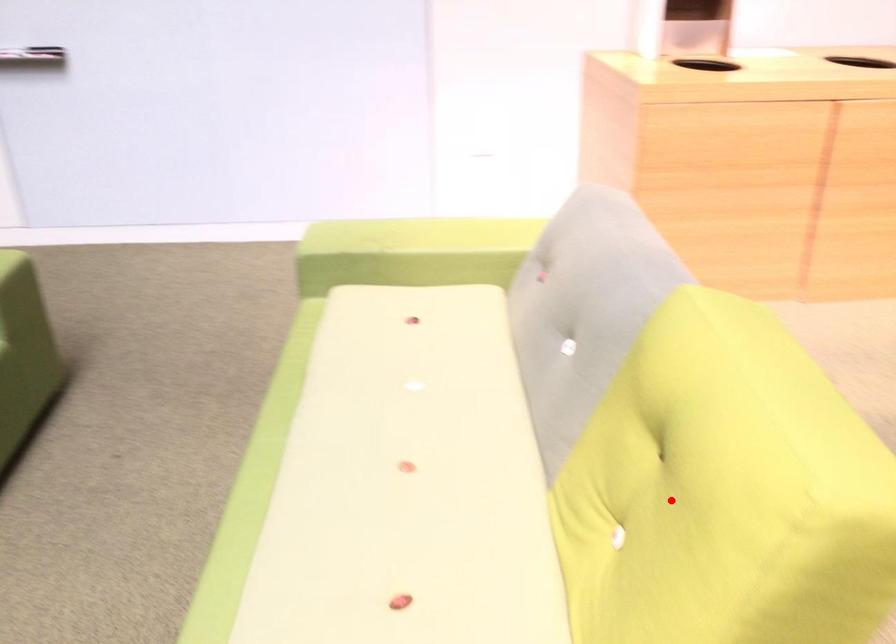
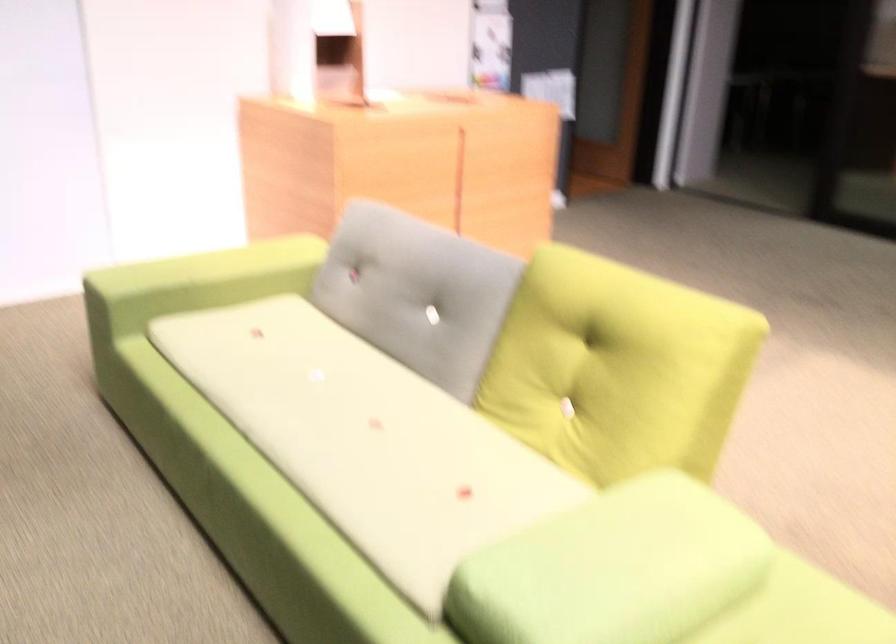
In the second image, find the point that corresponds to the highlighted location in the first image.

(616, 368)